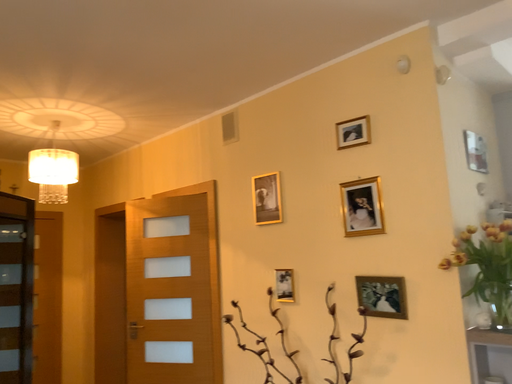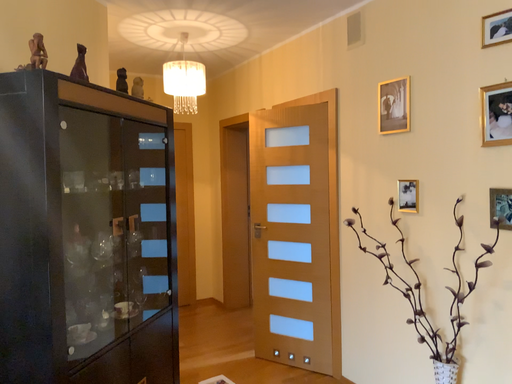
Question: How did the camera likely rotate when shooting the video?

Choices:
 (A) rotated left
 (B) rotated right

Answer: (A)